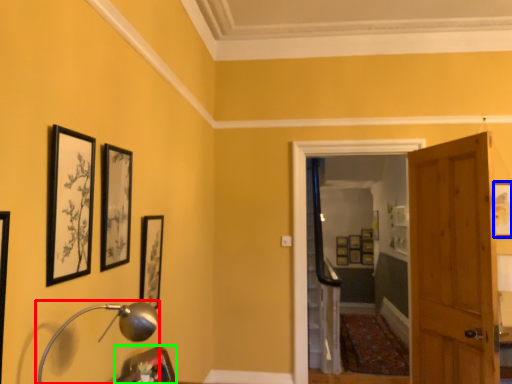
Question: Based on their relative distances, which object is nearer to table lamp (highlighted by a red box)? Choose from picture frame (highlighted by a blue box) and picture frame (highlighted by a green box).

Choices:
 (A) picture frame
 (B) picture frame

Answer: (B)